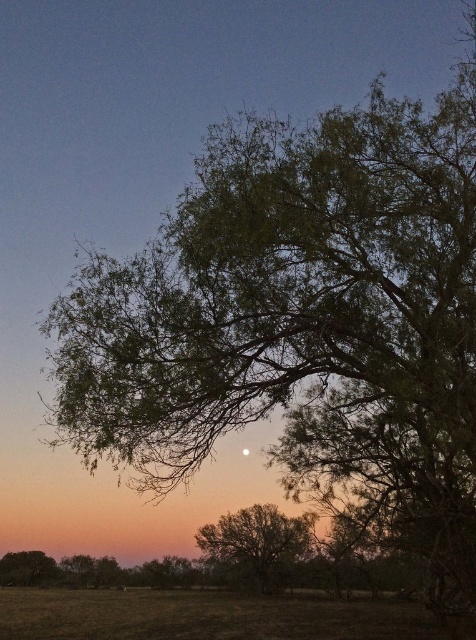
Can you confirm if green leafy tree at center is positioned to the right of green leafy tree at lower left?

Correct, you'll find green leafy tree at center to the right of green leafy tree at lower left.

Who is lower down, green leafy tree at center or green leafy tree at lower left?

green leafy tree at lower left

Locate an element on the screen. The width and height of the screenshot is (476, 640). green leafy tree at center is located at coordinates (256, 544).

Does green grassy field at lower center appear over green leafy tree at lower left?

Yes.

Can you confirm if green grassy field at lower center is thinner than green leafy tree at lower left?

Incorrect, green grassy field at lower center's width is not less than green leafy tree at lower left's.

Where is `green grassy field at lower center`? green grassy field at lower center is located at coordinates (210, 616).

Locate an element on the screen. This screenshot has width=476, height=640. green grassy field at lower center is located at coordinates (210, 616).

Does green grassy field at lower center appear under green leafy tree at center?

Yes, green grassy field at lower center is below green leafy tree at center.

Is green grassy field at lower center shorter than green leafy tree at center?

No, green grassy field at lower center is not shorter than green leafy tree at center.

Is point (178, 589) behind point (215, 545)?

That is True.

The image size is (476, 640). Find the location of `green grassy field at lower center`. green grassy field at lower center is located at coordinates (210, 616).